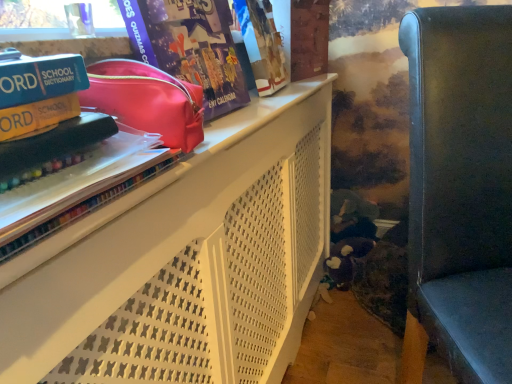
Image resolution: width=512 pixels, height=384 pixels. What do you see at coordinates (94, 146) in the screenshot?
I see `translucent plastic book at upper left` at bounding box center [94, 146].

Find the location of `white matte shelf at upper left`. white matte shelf at upper left is located at coordinates (186, 262).

Find the location of a particular element. The image size is (512, 384). yellow matte paperback book at upper left, which is the 1th paperback book from bottom to top is located at coordinates (37, 117).

What do you see at coordinates (147, 100) in the screenshot? I see `shiny pink pouch at upper center` at bounding box center [147, 100].

The width and height of the screenshot is (512, 384). Identify the location of translucent plastic book at upper left. (94, 146).

From a real-world perspective, relative to matte purple comic book at upper left, is yellow matte paperback book at upper left, which is the 1th paperback book from bottom to top, vertically above or below?

yellow matte paperback book at upper left, which is the 1th paperback book from bottom to top, is situated lower than matte purple comic book at upper left in the real world.

Which object is thinner, yellow matte paperback book at upper left, which is the 1th paperback book from bottom to top, or matte purple comic book at upper left?

yellow matte paperback book at upper left, which is the 1th paperback book from bottom to top, is thinner.

Which is behind, yellow matte paperback book at upper left, which ranks as the 2th paperback book in top-to-bottom order, or matte purple comic book at upper left?

matte purple comic book at upper left is further away from the camera.

Is point (64, 100) farther from viewer compared to point (181, 29)?

No, (64, 100) is in front of (181, 29).

Considering the sizes of objects yellow matte paperback book at upper left, which is the 1th paperback book from bottom to top, and white matte shelf at upper left in the image provided, who is bigger, yellow matte paperback book at upper left, which is the 1th paperback book from bottom to top, or white matte shelf at upper left?

white matte shelf at upper left is bigger.

Can you confirm if yellow matte paperback book at upper left, which is the 1th paperback book from bottom to top, is shorter than white matte shelf at upper left?

Indeed, yellow matte paperback book at upper left, which is the 1th paperback book from bottom to top, has a lesser height compared to white matte shelf at upper left.

Is yellow matte paperback book at upper left, which is the 1th paperback book from bottom to top, outside of shiny pink pouch at upper center?

yellow matte paperback book at upper left, which is the 1th paperback book from bottom to top, lies outside shiny pink pouch at upper center's area.

From a real-world perspective, is yellow matte paperback book at upper left, which ranks as the 2th paperback book in top-to-bottom order, beneath shiny pink pouch at upper center?

No.

Image resolution: width=512 pixels, height=384 pixels. I want to click on bag on the right of the yellow matte paperback book at upper left, which is the 1th paperback book from bottom to top, so click(x=147, y=100).

Which object is further away from the camera, yellow matte paperback book at upper left, which ranks as the 2th paperback book in top-to-bottom order, or shiny pink pouch at upper center?

shiny pink pouch at upper center is more distant.

Considering the relative positions of teal matte school dictionary at upper left, the 1th paperback book viewed from the top, and shiny pink pouch at upper center in the image provided, is teal matte school dictionary at upper left, the 1th paperback book viewed from the top, to the left of shiny pink pouch at upper center from the viewer's perspective?

Yes, teal matte school dictionary at upper left, the 1th paperback book viewed from the top, is to the left of shiny pink pouch at upper center.

Is teal matte school dictionary at upper left, which is the second paperback book in bottom-to-top order, bigger than shiny pink pouch at upper center?

Actually, teal matte school dictionary at upper left, which is the second paperback book in bottom-to-top order, might be smaller than shiny pink pouch at upper center.

Is teal matte school dictionary at upper left, the 1th paperback book viewed from the top, further to camera compared to shiny pink pouch at upper center?

No, teal matte school dictionary at upper left, the 1th paperback book viewed from the top, is in front of shiny pink pouch at upper center.

Between teal matte school dictionary at upper left, which is the second paperback book in bottom-to-top order, and shiny pink pouch at upper center, which one has larger width?

shiny pink pouch at upper center.

Considering the positions of objects yellow matte paperback book at upper left, which is the 1th paperback book from bottom to top, and translucent plastic book at upper left in the image provided, who is more to the left, yellow matte paperback book at upper left, which is the 1th paperback book from bottom to top, or translucent plastic book at upper left?

Positioned to the left is yellow matte paperback book at upper left, which is the 1th paperback book from bottom to top.

Considering the relative sizes of yellow matte paperback book at upper left, which is the 1th paperback book from bottom to top, and translucent plastic book at upper left in the image provided, is yellow matte paperback book at upper left, which is the 1th paperback book from bottom to top, wider than translucent plastic book at upper left?

No, yellow matte paperback book at upper left, which is the 1th paperback book from bottom to top, is not wider than translucent plastic book at upper left.

You are a GUI agent. You are given a task and a screenshot of the screen. Output one action in this format:
    pyautogui.click(x=<x>, y=<y>)
    Task: Click on the book that appears below the yellow matte paperback book at upper left, which ranks as the 2th paperback book in top-to-bottom order (from a real-world perspective)
    The width and height of the screenshot is (512, 384).
    Given the screenshot: What is the action you would take?
    pyautogui.click(x=94, y=146)

Based on the photo, is yellow matte paperback book at upper left, which ranks as the 2th paperback book in top-to-bottom order, positioned before translucent plastic book at upper left?

That is False.

Is teal matte school dictionary at upper left, which is the second paperback book in bottom-to-top order, to the right of metallic gray chair at right from the viewer's perspective?

No, teal matte school dictionary at upper left, which is the second paperback book in bottom-to-top order, is not to the right of metallic gray chair at right.

Which point is more distant from viewer, (0, 96) or (466, 24)?

The point (466, 24) is behind.

Is teal matte school dictionary at upper left, which is the second paperback book in bottom-to-top order, aimed at metallic gray chair at right?

No, teal matte school dictionary at upper left, which is the second paperback book in bottom-to-top order, is not facing towards metallic gray chair at right.

Is teal matte school dictionary at upper left, which is the second paperback book in bottom-to-top order, not near metallic gray chair at right?

That's not correct — teal matte school dictionary at upper left, which is the second paperback book in bottom-to-top order, is a little close to metallic gray chair at right.

What are the coordinates of `furniture located underneath the yellow matte paperback book at upper left, which is the 1th paperback book from bottom to top (from a real-world perspective)` in the screenshot? It's located at (460, 190).

Does yellow matte paperback book at upper left, which is the 1th paperback book from bottom to top, have a greater width compared to metallic gray chair at right?

Incorrect, the width of yellow matte paperback book at upper left, which is the 1th paperback book from bottom to top, does not surpass that of metallic gray chair at right.

Can we say yellow matte paperback book at upper left, which ranks as the 2th paperback book in top-to-bottom order, lies outside metallic gray chair at right?

Yes, yellow matte paperback book at upper left, which ranks as the 2th paperback book in top-to-bottom order, is located beyond the bounds of metallic gray chair at right.

From a real-world perspective, between yellow matte paperback book at upper left, which ranks as the 2th paperback book in top-to-bottom order, and metallic gray chair at right, who is vertically higher?

yellow matte paperback book at upper left, which ranks as the 2th paperback book in top-to-bottom order, is physically above.

Identify the location of the 2nd paperback book counting from the left of the matte purple comic book at upper left. Image resolution: width=512 pixels, height=384 pixels. (37, 117).

You are a GUI agent. You are given a task and a screenshot of the screen. Output one action in this format:
    pyautogui.click(x=<x>, y=<y>)
    Task: Click on the shelf on the right of yellow matte paperback book at upper left, which is the 1th paperback book from bottom to top
    The width and height of the screenshot is (512, 384).
    Given the screenshot: What is the action you would take?
    pyautogui.click(x=186, y=262)

When comparing their distances from white matte shelf at upper left, does matte purple comic book at upper left or metallic gray chair at right seem further?

The object further to white matte shelf at upper left is metallic gray chair at right.

Based on their spatial positions, is translucent plastic book at upper left or matte purple comic book at upper left closer to yellow matte paperback book at upper left, which is the 1th paperback book from bottom to top?

Among the two, translucent plastic book at upper left is located nearer to yellow matte paperback book at upper left, which is the 1th paperback book from bottom to top.

Based on their spatial positions, is yellow matte paperback book at upper left, which ranks as the 2th paperback book in top-to-bottom order, or teal matte school dictionary at upper left, which is the second paperback book in bottom-to-top order, closer to white matte shelf at upper left?

teal matte school dictionary at upper left, which is the second paperback book in bottom-to-top order, lies closer to white matte shelf at upper left than the other object.

From the image, which object appears to be nearer to white matte shelf at upper left, shiny pink pouch at upper center or yellow matte paperback book at upper left, which ranks as the 2th paperback book in top-to-bottom order?

shiny pink pouch at upper center lies closer to white matte shelf at upper left than the other object.

Based on their spatial positions, is shiny pink pouch at upper center or white matte shelf at upper left closer to matte purple comic book at upper left?

shiny pink pouch at upper center lies closer to matte purple comic book at upper left than the other object.

Estimate the real-world distances between objects in this image. Which object is closer to white matte shelf at upper left, metallic gray chair at right or teal matte school dictionary at upper left, which is the second paperback book in bottom-to-top order?

metallic gray chair at right is closer to white matte shelf at upper left.

Considering their positions, is translucent plastic book at upper left positioned closer to matte purple comic book at upper left than metallic gray chair at right?

Among the two, translucent plastic book at upper left is located nearer to matte purple comic book at upper left.

Based on their spatial positions, is translucent plastic book at upper left or shiny pink pouch at upper center further from yellow matte paperback book at upper left, which is the 1th paperback book from bottom to top?

Among the two, shiny pink pouch at upper center is located further to yellow matte paperback book at upper left, which is the 1th paperback book from bottom to top.

At what (x,y) coordinates should I click in order to perform the action: click on bag between translucent plastic book at upper left and metallic gray chair at right from left to right. Please return your answer as a coordinate pair (x, y). The width and height of the screenshot is (512, 384). Looking at the image, I should click on (147, 100).

Where is `bag that lies between matte purple comic book at upper left and white matte shelf at upper left from top to bottom`? The image size is (512, 384). bag that lies between matte purple comic book at upper left and white matte shelf at upper left from top to bottom is located at coordinates (147, 100).

Identify the location of paperback book that lies between teal matte school dictionary at upper left, which is the second paperback book in bottom-to-top order, and white matte shelf at upper left from top to bottom. Image resolution: width=512 pixels, height=384 pixels. (37, 117).

The height and width of the screenshot is (384, 512). Identify the location of bag situated between teal matte school dictionary at upper left, which is the second paperback book in bottom-to-top order, and metallic gray chair at right from left to right. (147, 100).